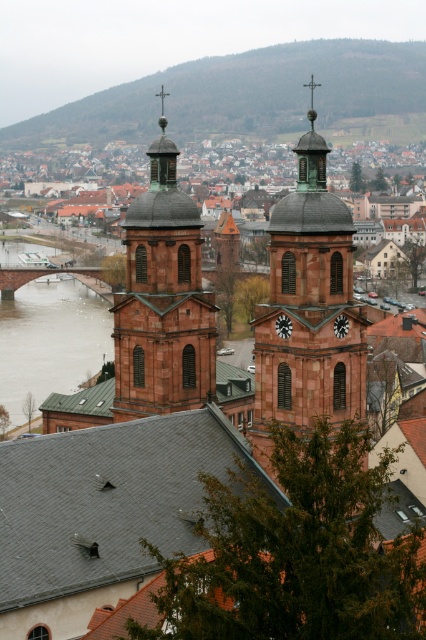
Question: Is brown stone church towers at center bigger than reddish-brown stone clock tower at center?

Choices:
 (A) yes
 (B) no

Answer: (A)

Question: Among these points, which one is farthest from the camera?

Choices:
 (A) (333, 164)
 (B) (347, 278)

Answer: (A)

Question: Observing the image, what is the correct spatial positioning of reddish-brown stone clock tower at center in reference to brown concrete bridge at lower left?

Choices:
 (A) below
 (B) above

Answer: (B)

Question: Which point is farther to the camera?

Choices:
 (A) matte copper clock tower at center
 (B) concrete stone bridge at left
 (C) brown stone church towers at center

Answer: (B)

Question: Can you confirm if matte copper clock tower at center is wider than concrete stone bridge at left?

Choices:
 (A) no
 (B) yes

Answer: (A)

Question: Which object is positioned closest to the brown stone church towers at center?

Choices:
 (A) brown concrete bridge at lower left
 (B) concrete stone bridge at left

Answer: (B)